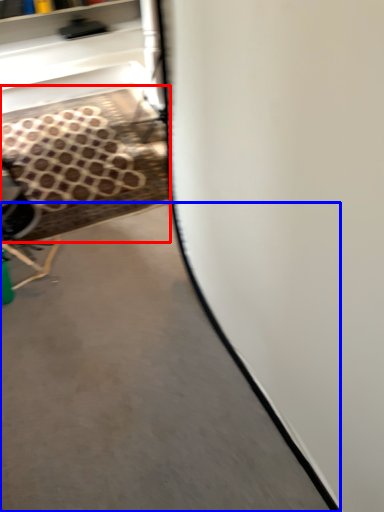
Question: Which object is closer to the camera taking this photo, stair (highlighted by a red box) or concrete (highlighted by a blue box)?

Choices:
 (A) stair
 (B) concrete

Answer: (B)